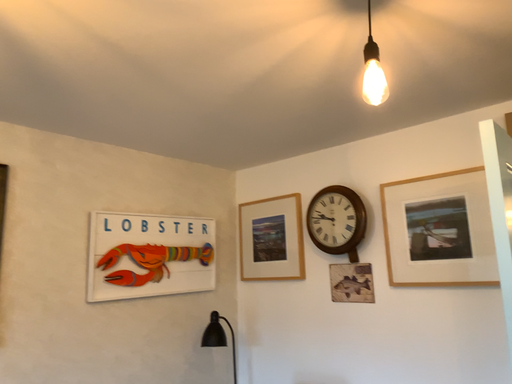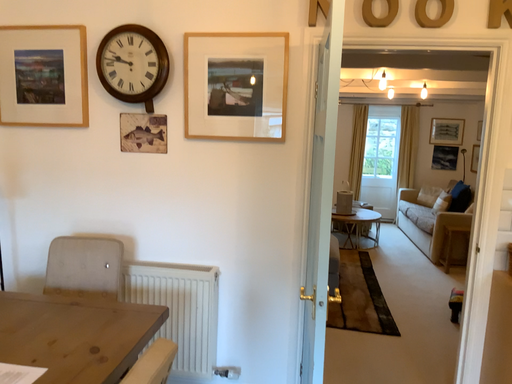
Question: Which way did the camera rotate in the video?

Choices:
 (A) rotated upward
 (B) rotated downward

Answer: (B)